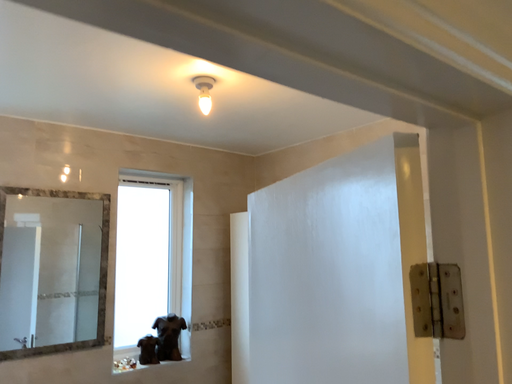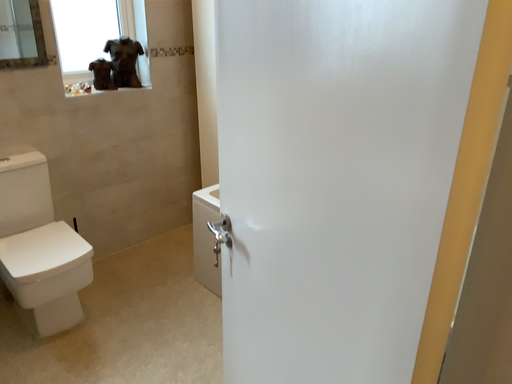
Question: Which way did the camera rotate in the video?

Choices:
 (A) rotated upward
 (B) rotated downward

Answer: (B)